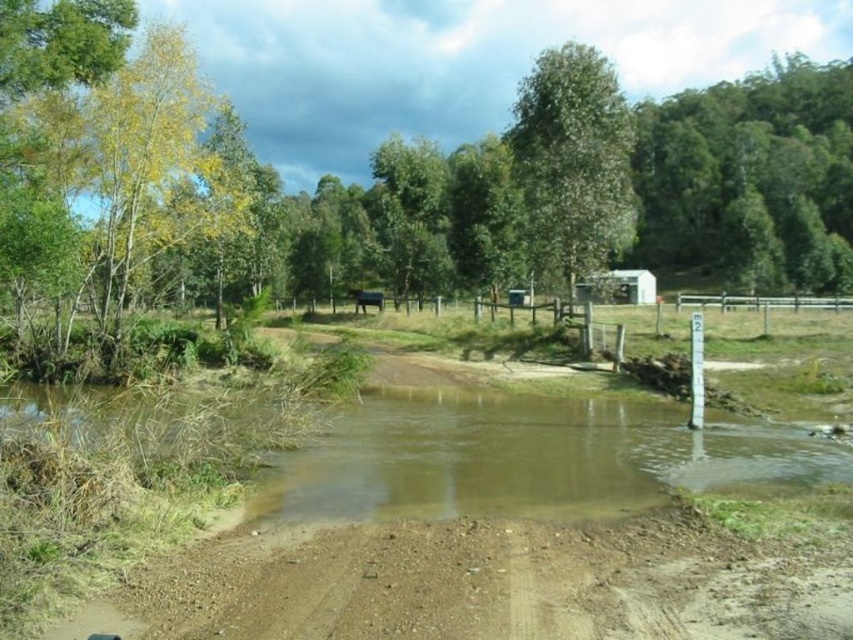
Question: Among these objects, which one is nearest to the camera?

Choices:
 (A) green leafy tree at upper center
 (B) green leafy trees at upper right
 (C) yellow-green foliage at upper left

Answer: (C)

Question: In this image, where is yellow-green foliage at upper left located relative to green leafy trees at upper right?

Choices:
 (A) below
 (B) above

Answer: (A)

Question: Which object appears closest to the camera in this image?

Choices:
 (A) yellow-green foliage at upper left
 (B) green leafy trees at upper right

Answer: (A)

Question: Can you confirm if yellow-green foliage at upper left is positioned to the left of green leafy trees at upper right?

Choices:
 (A) yes
 (B) no

Answer: (A)

Question: Does yellow-green foliage at upper left have a lesser width compared to green leafy trees at upper right?

Choices:
 (A) no
 (B) yes

Answer: (B)

Question: Which point is closer to the camera taking this photo?

Choices:
 (A) (595, 163)
 (B) (705, 176)
 (C) (167, 196)

Answer: (A)